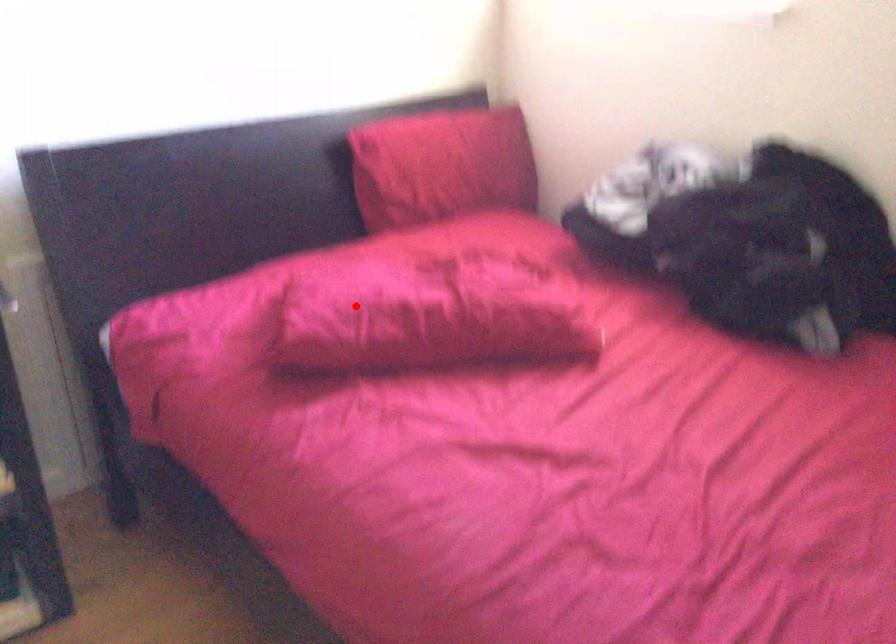
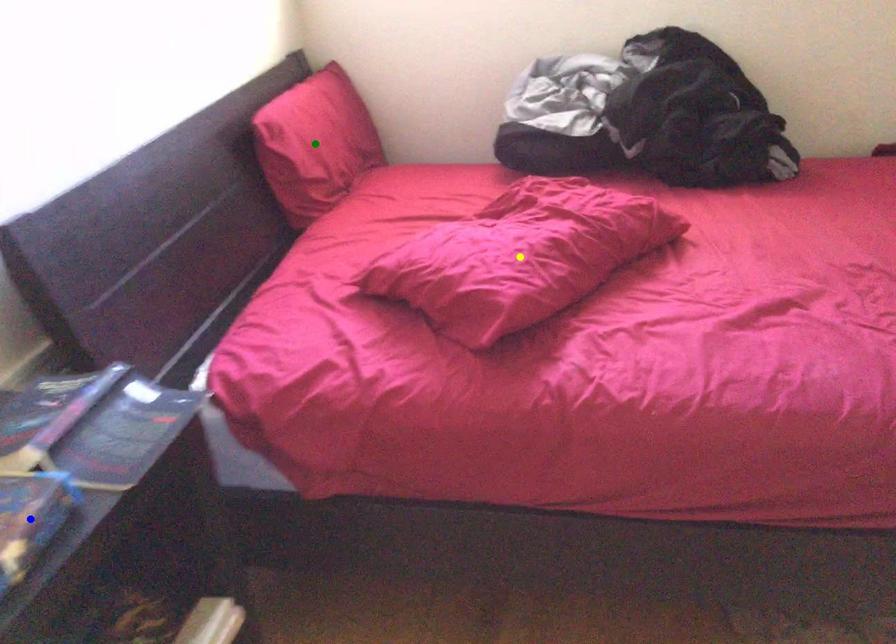
Question: I am providing you with two images of the same scene from different viewpoints. A red point is marked on the first image. You are given multiple points on the second image. Which mark in image 2 goes with the point in image 1?

Choices:
 (A) yellow point
 (B) blue point
 (C) green point

Answer: (A)